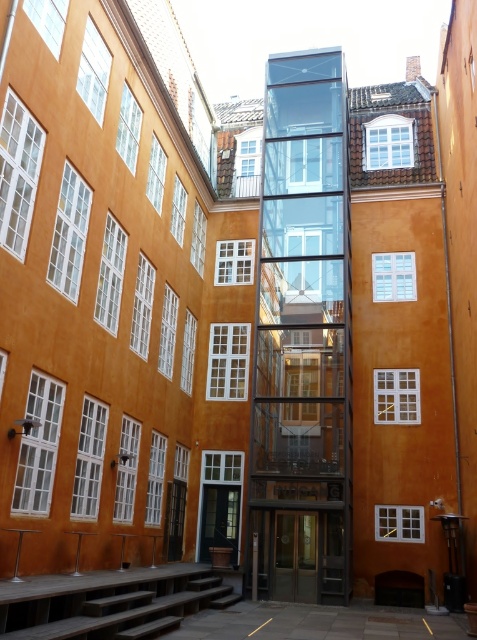
Is transparent glass elevator at center smaller than wooden door at center?

No, transparent glass elevator at center is not smaller than wooden door at center.

Between transparent glass elevator at center and wooden door at center, which one has more height?

With more height is transparent glass elevator at center.

The width and height of the screenshot is (477, 640). What are the coordinates of `transparent glass elevator at center` in the screenshot? It's located at (302, 339).

Who is taller, dark brown wooden stairs at lower left or wooden door at center?

dark brown wooden stairs at lower left is taller.

Between dark brown wooden stairs at lower left and wooden door at center, which one is positioned higher?

dark brown wooden stairs at lower left is above.

Is point (167, 588) farther from viewer compared to point (217, 529)?

No, it is in front of (217, 529).

Find the location of a particular element. dark brown wooden stairs at lower left is located at coordinates (111, 604).

Does dark brown wooden stairs at lower left come behind metallic glass door at center?

No, dark brown wooden stairs at lower left is in front of metallic glass door at center.

Which is behind, point (113, 636) or point (327, 582)?

Positioned behind is point (327, 582).

Find the location of a particular element. dark brown wooden stairs at lower left is located at coordinates (111, 604).